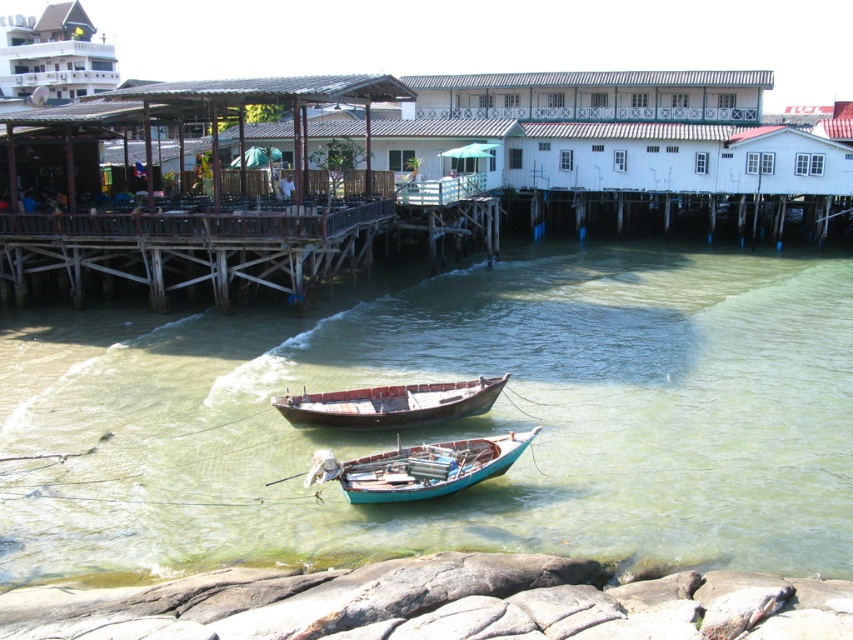
Is point (849, 483) in front of point (425, 412)?

Yes, point (849, 483) is closer to viewer.

Image resolution: width=853 pixels, height=640 pixels. I want to click on clear water at center, so click(x=469, y=420).

Who is shorter, clear water at center or teal wooden boat at center?

teal wooden boat at center

Which is below, clear water at center or teal wooden boat at center?

teal wooden boat at center

The image size is (853, 640). I want to click on clear water at center, so click(469, 420).

Identify the location of clear water at center. This screenshot has height=640, width=853. (469, 420).

Can you confirm if teal wooden boat at center is positioned above rusty wooden boat at center?

Actually, teal wooden boat at center is below rusty wooden boat at center.

Does point (468, 481) lie behind point (457, 412)?

No, (468, 481) is closer to viewer.

You are a GUI agent. You are given a task and a screenshot of the screen. Output one action in this format:
    pyautogui.click(x=<x>, y=<y>)
    Task: Click on the teal wooden boat at center
    The width and height of the screenshot is (853, 640).
    Given the screenshot: What is the action you would take?
    pyautogui.click(x=428, y=468)